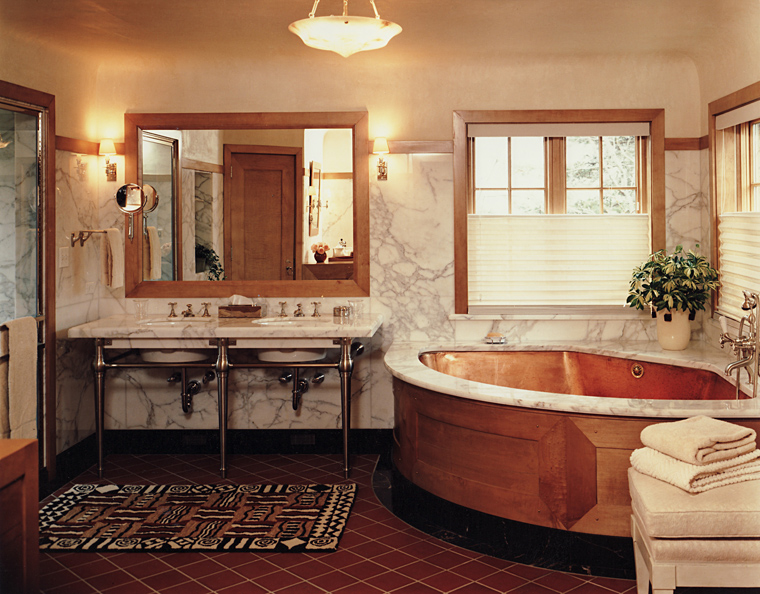
Find the location of a particular element. This screenshot has width=760, height=594. window is located at coordinates [x=492, y=166], [x=574, y=159], [x=752, y=157].